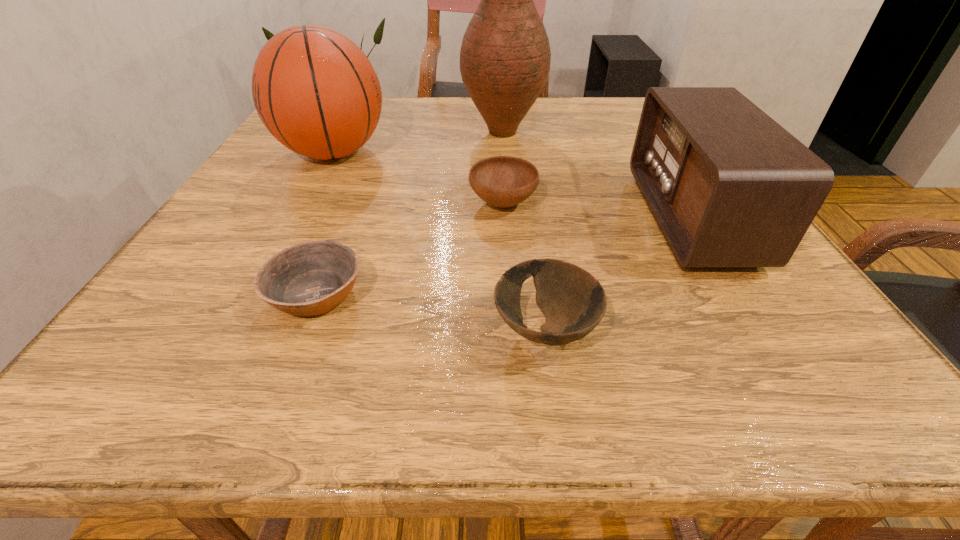
The height and width of the screenshot is (540, 960). I want to click on vacant space at the far edge of the desktop, so click(x=449, y=105).

Image resolution: width=960 pixels, height=540 pixels. Find the location of `vacant space at the near edge`. vacant space at the near edge is located at coordinates (284, 348).

Locate an element on the screen. This screenshot has width=960, height=540. free space at the left edge is located at coordinates (179, 269).

Identify the location of free spot at the right edge of the desktop. This screenshot has width=960, height=540. (710, 276).

Locate an element on the screen. vacant space at the near left corner is located at coordinates (111, 368).

Where is `vacant space at the far right corner`? This screenshot has width=960, height=540. vacant space at the far right corner is located at coordinates (611, 112).

Locate an element on the screen. Image resolution: width=960 pixels, height=540 pixels. vacant space at the near right corner of the desktop is located at coordinates (753, 359).

The image size is (960, 540). I want to click on empty space between the shortest bowl and the vase, so click(410, 213).

Find the location of `free point between the farthest bowl and the shortest object`. free point between the farthest bowl and the shortest object is located at coordinates (410, 249).

Locate an element on the screen. This screenshot has width=960, height=540. unoccupied area between the rightmost object and the farthest bowl is located at coordinates (597, 211).